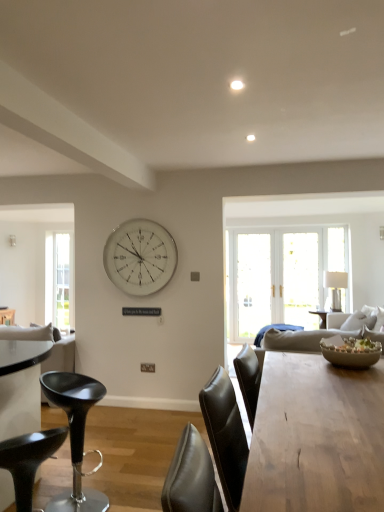
Question: Should I look upward or downward to see black leather stool at lower left, which is the 2th chair in front-to-back order?

Choices:
 (A) down
 (B) up

Answer: (A)

Question: From a real-world perspective, does black leather stool at lower left, the second chair in the back-to-front sequence, stand above silver metallic clock at center?

Choices:
 (A) yes
 (B) no

Answer: (B)

Question: Is black leather stool at lower left, the second chair in the back-to-front sequence, outside silver metallic clock at center?

Choices:
 (A) no
 (B) yes

Answer: (B)

Question: Is silver metallic clock at center located within black leather stool at lower left, the second chair in the back-to-front sequence?

Choices:
 (A) yes
 (B) no

Answer: (B)

Question: Is black leather stool at lower left, the second chair in the back-to-front sequence, oriented away from silver metallic clock at center?

Choices:
 (A) no
 (B) yes

Answer: (A)

Question: Considering the relative sizes of black leather stool at lower left, the second chair in the back-to-front sequence, and silver metallic clock at center in the image provided, is black leather stool at lower left, the second chair in the back-to-front sequence, shorter than silver metallic clock at center?

Choices:
 (A) no
 (B) yes

Answer: (B)

Question: Is black leather stool at lower left, the second chair in the back-to-front sequence, placed right next to silver metallic clock at center?

Choices:
 (A) no
 (B) yes

Answer: (A)

Question: Can you confirm if clear glass window at left is positioned to the right of white glossy lamp at right?

Choices:
 (A) yes
 (B) no

Answer: (B)

Question: Is clear glass window at left shorter than white glossy lamp at right?

Choices:
 (A) no
 (B) yes

Answer: (A)

Question: Does clear glass window at left have a lesser width compared to white glossy lamp at right?

Choices:
 (A) no
 (B) yes

Answer: (B)

Question: Does clear glass window at left come behind white glossy lamp at right?

Choices:
 (A) no
 (B) yes

Answer: (B)

Question: Can you confirm if clear glass window at left is smaller than white glossy lamp at right?

Choices:
 (A) yes
 (B) no

Answer: (A)

Question: Is clear glass window at left positioned beyond the bounds of white glossy lamp at right?

Choices:
 (A) yes
 (B) no

Answer: (A)

Question: Could wooden table at center be considered to be inside clear glass window at left?

Choices:
 (A) no
 (B) yes

Answer: (A)